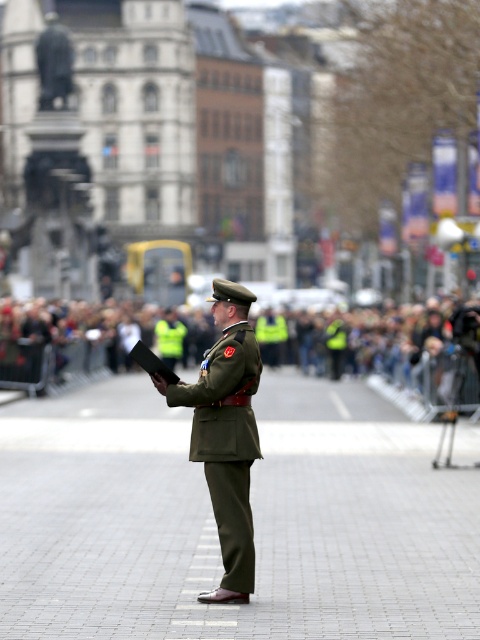
Is reflective yellow vests at center shorter than matte olive green uniform at center?

No.

Find the location of a particular element. Image resolution: width=480 pixels, height=640 pixels. reflective yellow vests at center is located at coordinates (385, 352).

Who is more forward, (110, 301) or (168, 326)?

Point (168, 326)

Can you confirm if reflective yellow vests at center is thinner than green matte uniform at center?

Incorrect, reflective yellow vests at center's width is not less than green matte uniform at center's.

Does point (411, 417) come farther from viewer compared to point (157, 340)?

No.

I want to click on reflective yellow vests at center, so (x=385, y=352).

Is point (236, 326) positioned before point (156, 328)?

Yes, it is.

Which of these two, matte olive green uniform at center or green matte uniform at center, stands taller?

matte olive green uniform at center is taller.

Does point (230, 384) come farther from viewer compared to point (180, 344)?

No.

This screenshot has width=480, height=640. Identify the location of matte olive green uniform at center. (227, 442).